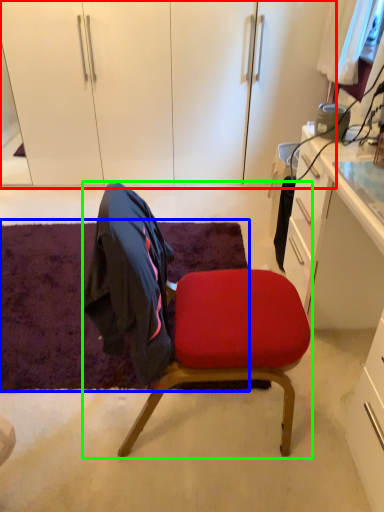
Question: Which is farther away from dresser (highlighted by a red box)? mat (highlighted by a blue box) or chair (highlighted by a green box)?

Choices:
 (A) mat
 (B) chair

Answer: (B)